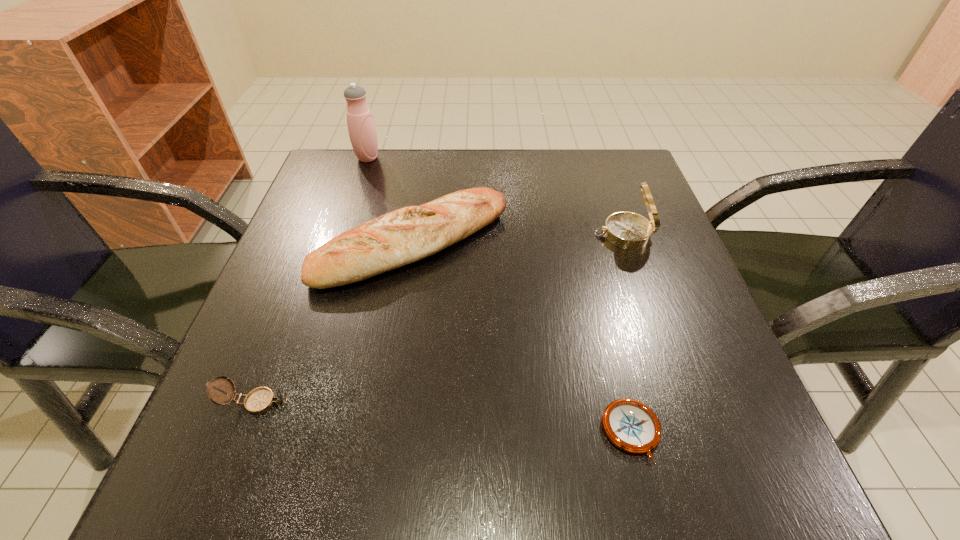
The image size is (960, 540). Identify the location of thermos bottle. (362, 132).

The height and width of the screenshot is (540, 960). In order to click on the farthest object in this screenshot , I will do `click(362, 132)`.

This screenshot has height=540, width=960. What are the coordinates of `the farthest compass` in the screenshot? It's located at (627, 230).

This screenshot has height=540, width=960. What are the coordinates of `the tallest compass` in the screenshot? It's located at (627, 230).

At what (x,y) coordinates should I click in order to perform the action: click on baguet. Please return your answer as a coordinate pair (x, y). Looking at the image, I should click on (395, 239).

Locate an element on the screen. The height and width of the screenshot is (540, 960). the leftmost compass is located at coordinates (260, 400).

The image size is (960, 540). Identify the location of the second shortest compass. (260, 400).

Where is `the shortest compass`? This screenshot has width=960, height=540. the shortest compass is located at coordinates (632, 426).

This screenshot has height=540, width=960. Find the location of `vacant space located 0.060m on the left of the farthest object`. vacant space located 0.060m on the left of the farthest object is located at coordinates (330, 158).

The width and height of the screenshot is (960, 540). Find the location of `vacant space located 0.100m with the dial facing the fourth shortest object`. vacant space located 0.100m with the dial facing the fourth shortest object is located at coordinates pyautogui.click(x=544, y=234).